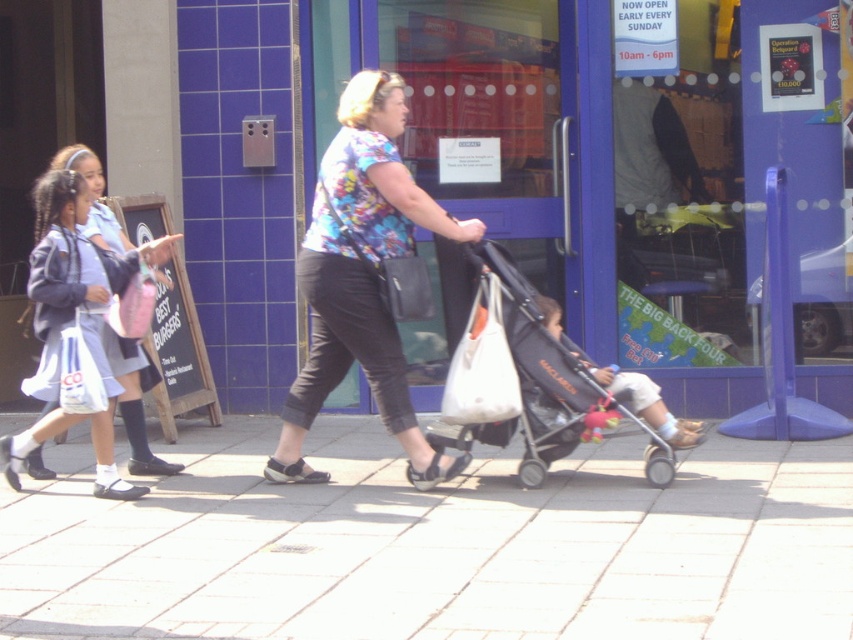
Is blue glass door at center taller than floral fabric shirt at center?

In fact, blue glass door at center may be shorter than floral fabric shirt at center.

Measure the distance between point (601, 44) and camera.

They are 25.48 feet apart.

In order to click on blue glass door at center in this screenshot , I will do `click(495, 164)`.

In the scene shown: Can you confirm if floral fabric shirt at center is positioned to the left of light beige fabric stroller at center?

Yes, floral fabric shirt at center is to the left of light beige fabric stroller at center.

This screenshot has height=640, width=853. What are the coordinates of `floral fabric shirt at center` in the screenshot? It's located at point(363,276).

Between point (527, 380) and point (581, 353), which one is positioned behind?

Point (581, 353)

Does black fabric stroller at center appear over light beige fabric stroller at center?

Incorrect, black fabric stroller at center is not positioned above light beige fabric stroller at center.

This screenshot has height=640, width=853. Find the location of `black fabric stroller at center`. black fabric stroller at center is located at coordinates (538, 365).